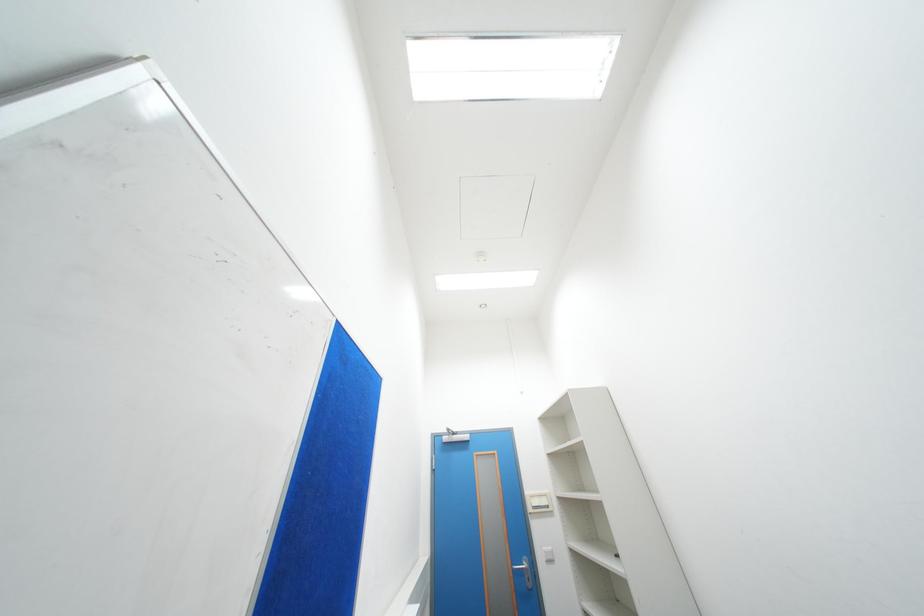
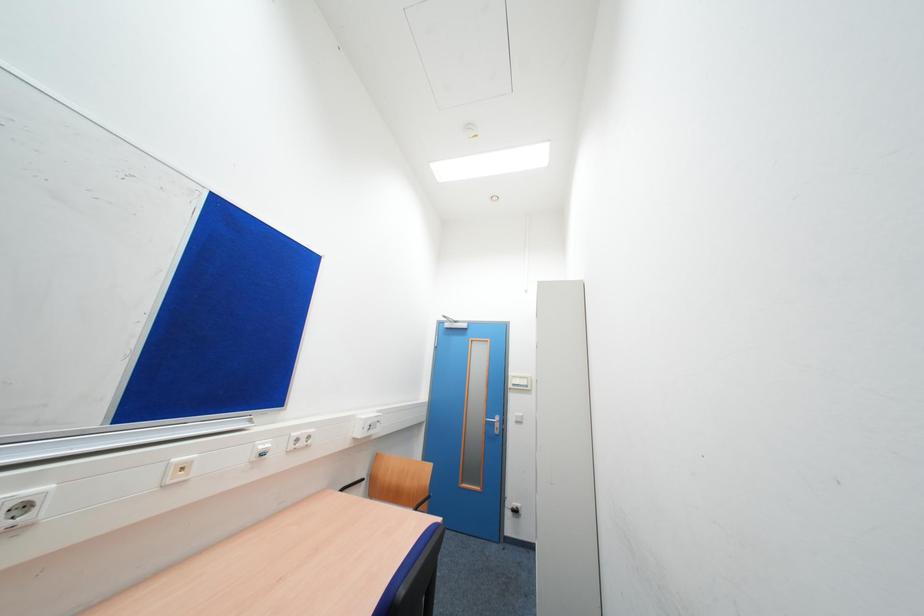
Question: What movement of the cameraman would produce the second image?

Choices:
 (A) Left
 (B) Right
 (C) Forward
 (D) Backward

Answer: (B)